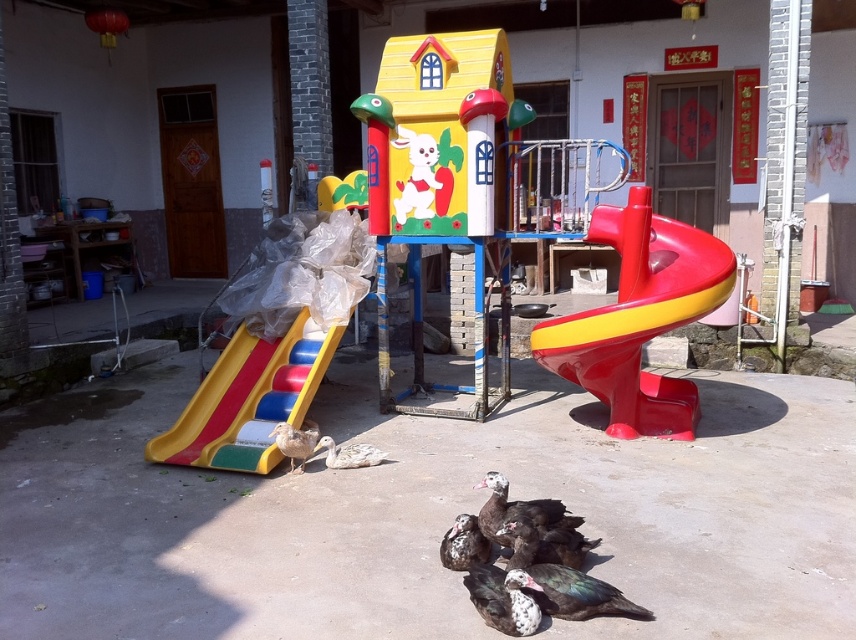
Question: Observing the image, what is the correct spatial positioning of dark brown feathers at center in reference to brown feathered duck at lower left?

Choices:
 (A) left
 (B) right

Answer: (B)

Question: Considering the relative positions of multicolored plastic slide at lower left and brown feathered duck at lower left in the image provided, where is multicolored plastic slide at lower left located with respect to brown feathered duck at lower left?

Choices:
 (A) below
 (B) above

Answer: (B)

Question: Estimate the real-world distances between objects in this image. Which object is closer to the white matte duck at lower center?

Choices:
 (A) shiny plastic slide at right
 (B) dark brown feathers at center

Answer: (B)

Question: Does multicolored plastic slide at lower left appear on the right side of speckled feathered duckling at center?

Choices:
 (A) yes
 (B) no

Answer: (B)

Question: Which is nearer to the brown feathered duck at lower left?

Choices:
 (A) multicolored plastic slide at lower left
 (B) shiny plastic slide at right
 (C) white matte duck at lower center

Answer: (C)

Question: Among these objects, which one is nearest to the camera?

Choices:
 (A) shiny plastic slide at right
 (B) dark brown feathers at center
 (C) white matte duck at lower center

Answer: (B)